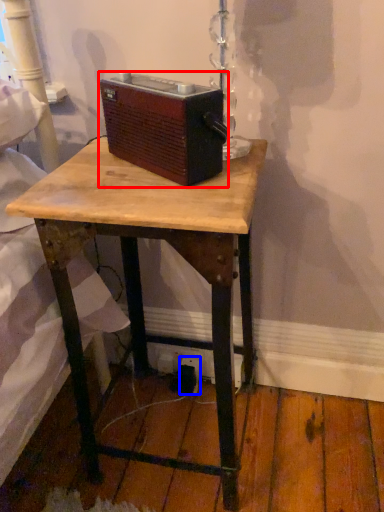
Question: Which point is further to the camera, gadget (highlighted by a red box) or electric outlet (highlighted by a blue box)?

Choices:
 (A) gadget
 (B) electric outlet

Answer: (B)